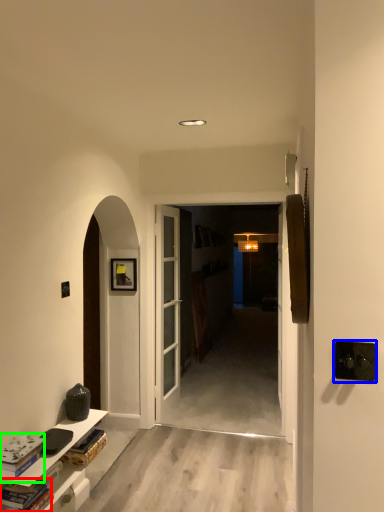
Question: Which is nearer to the book (highlighted by a red box)? door handle (highlighted by a blue box) or book (highlighted by a green box).

Choices:
 (A) door handle
 (B) book

Answer: (B)